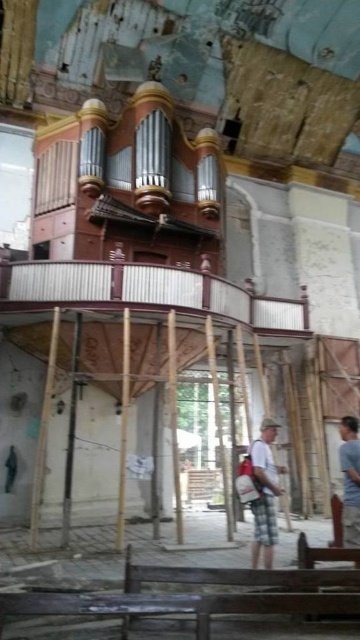
Question: Is wooden bench at lower center thinner than light brown wooden person at lower right?

Choices:
 (A) no
 (B) yes

Answer: (A)

Question: Which is farther from the light brown wooden person at lower right?

Choices:
 (A) wooden bench at lower center
 (B) light brown plaid shorts at center

Answer: (A)

Question: Can you confirm if wooden bench at lower center is positioned to the left of light brown wooden person at lower right?

Choices:
 (A) yes
 (B) no

Answer: (A)

Question: Does wooden bench at lower center have a greater width compared to light brown wooden person at lower right?

Choices:
 (A) yes
 (B) no

Answer: (A)

Question: Which point appears closest to the camera in this image?

Choices:
 (A) click(267, 596)
 (B) click(270, 451)
 (C) click(358, 449)

Answer: (A)

Question: Estimate the real-world distances between objects in this image. Which object is closer to the light brown wooden person at lower right?

Choices:
 (A) wooden bench at lower center
 (B) light brown plaid shorts at center

Answer: (B)